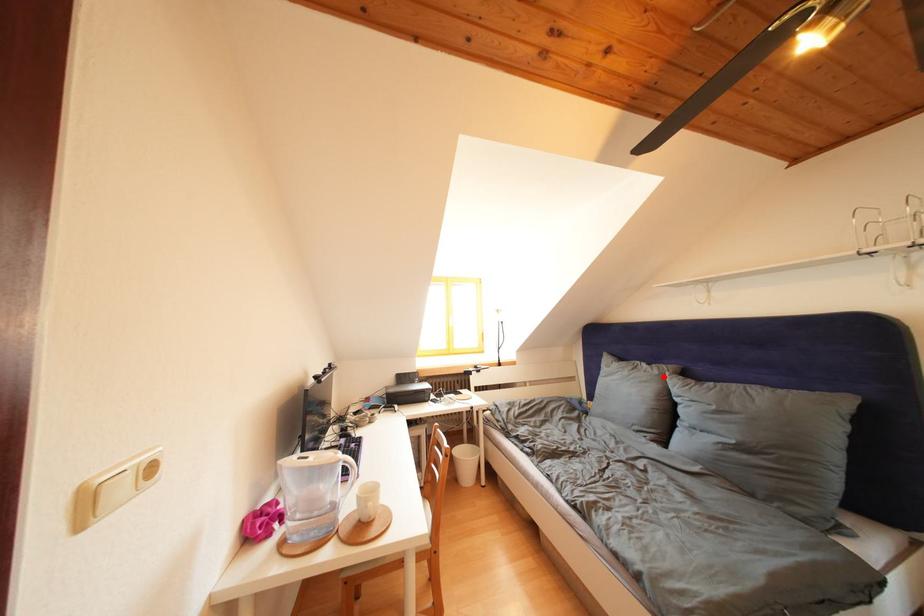
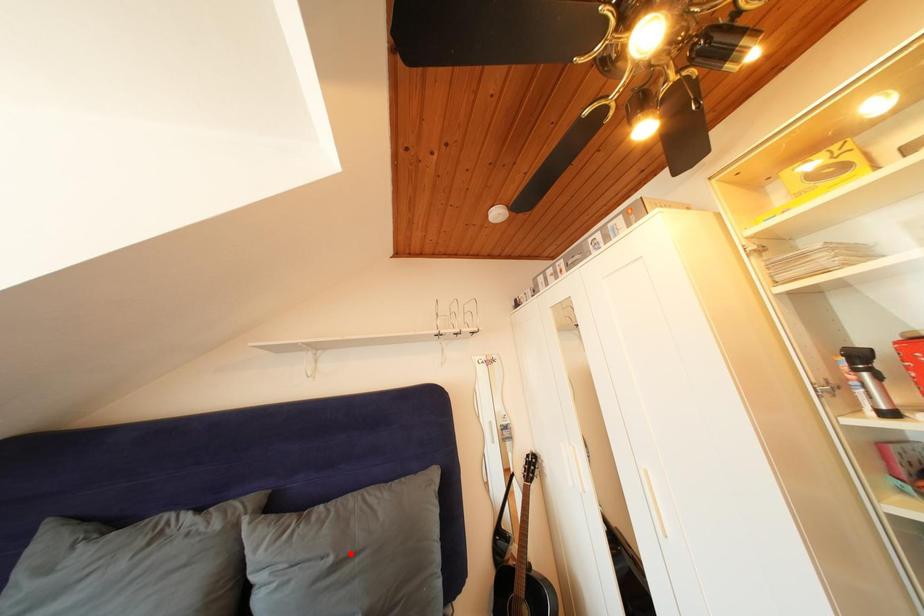
I am providing you with two images of the same scene from different viewpoints. A red point is marked on the first image and another point is marked on the second image. Is the marked point in image1 the same physical position as the marked point in image2?

No